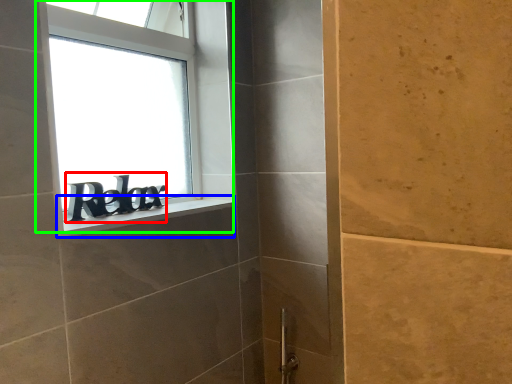
Question: Which object is positioned closest to writing (highlighted by a red box)? Select from window sill (highlighted by a blue box) and window (highlighted by a green box).

Choices:
 (A) window sill
 (B) window

Answer: (A)